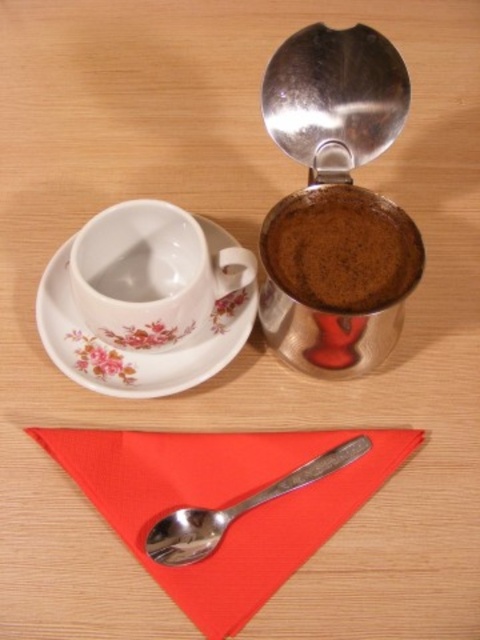
You are a barista who needs to grind coffee beans. The coffee grinder is located at a specific coordinate. Can you determine if the shiny metallic coffee grinder at upper right is positioned to the right of the center point of the table?

The shiny metallic coffee grinder at upper right is located at coordinate point 0.319 on the x axis. Since the center point of the table would be at 0.5 on the x axis, the coffee grinder is positioned to the left of the center point of the table.

You are a server who needs to place a 10 inch long decorative ribbon between the red fabric napkin at lower center and the dark brown ground coffee at upper right. Can you fit the ribbon between them without overlapping either object?

The red fabric napkin at lower center and dark brown ground coffee at upper right are 9.26 inches apart. Since the ribbon is 10 inches long, it cannot fit between them without overlapping either object because the distance is shorter than the ribbon.

In the scene shown: You are setting up a dining table and need to place the shiny metallic coffee grinder at upper right and the red fabric napkin at lower center. According to the image, which object is located to the right of the other?

The shiny metallic coffee grinder at upper right is positioned on the right side of the red fabric napkin at lower center.